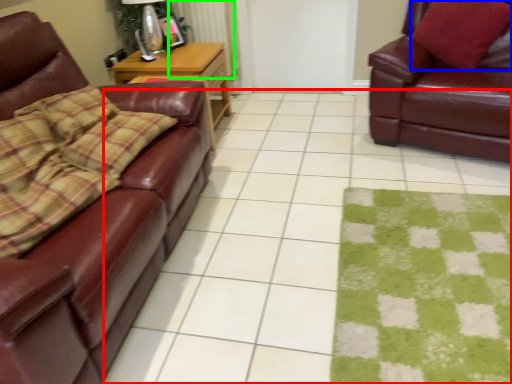
Question: Based on their relative distances, which object is nearer to square (highlighted by a red box)? Choose from throw pillow (highlighted by a blue box) and radiator (highlighted by a green box).

Choices:
 (A) throw pillow
 (B) radiator

Answer: (A)